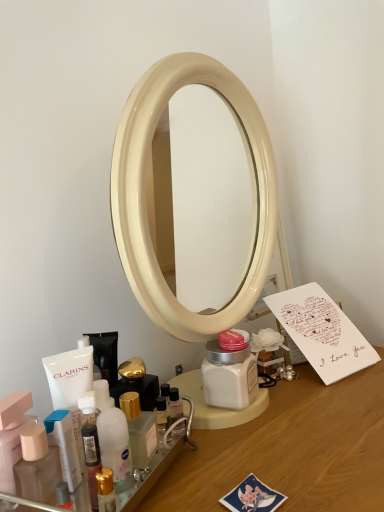
This screenshot has width=384, height=512. What are the coordinates of `free space in front of white paper card at right` in the screenshot? It's located at (331, 458).